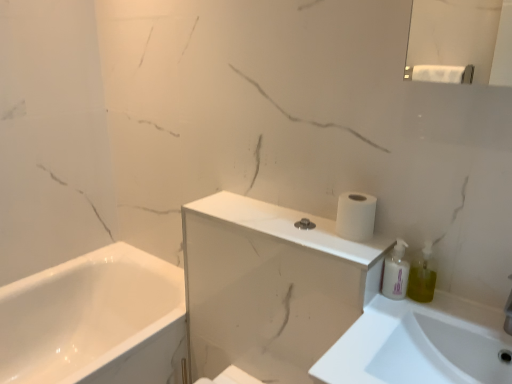
Question: Considering the positions of white glossy medicine cabinet at upper center and green translucent soap dispenser at right in the image, is white glossy medicine cabinet at upper center wider or thinner than green translucent soap dispenser at right?

Choices:
 (A) thin
 (B) wide

Answer: (B)

Question: Is white glossy medicine cabinet at upper center inside the boundaries of green translucent soap dispenser at right, or outside?

Choices:
 (A) outside
 (B) inside

Answer: (A)

Question: Which of these objects is positioned closest to the white glossy medicine cabinet at upper center?

Choices:
 (A) green translucent soap dispenser at right
 (B) white glossy sink at lower right
 (C) white glossy pump bottle at right
 (D) white matte toilet paper at upper right

Answer: (B)

Question: Which is nearer to the white matte toilet paper at upper right?

Choices:
 (A) white glossy pump bottle at right
 (B) green translucent soap dispenser at right
 (C) white glossy sink at lower right
 (D) white glossy medicine cabinet at upper center

Answer: (A)